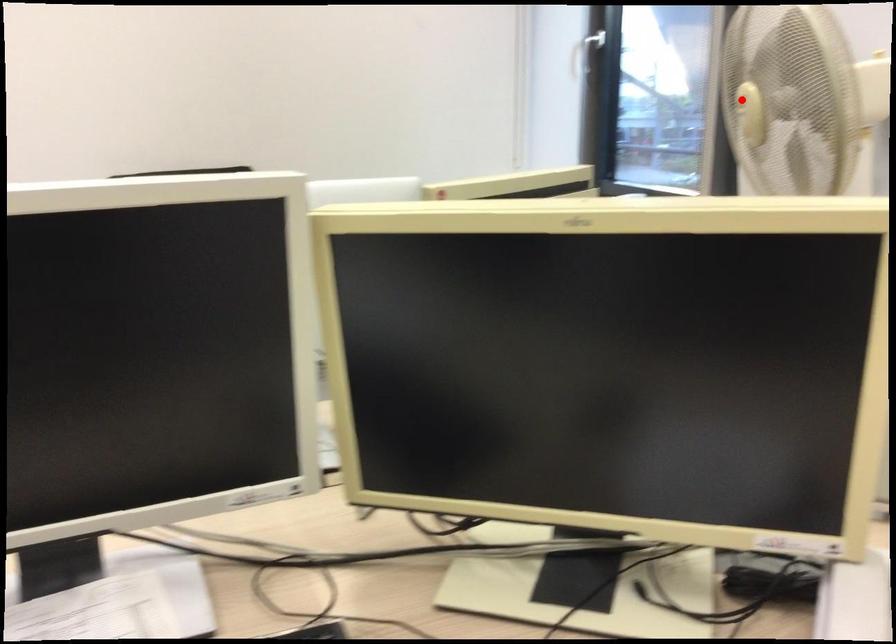
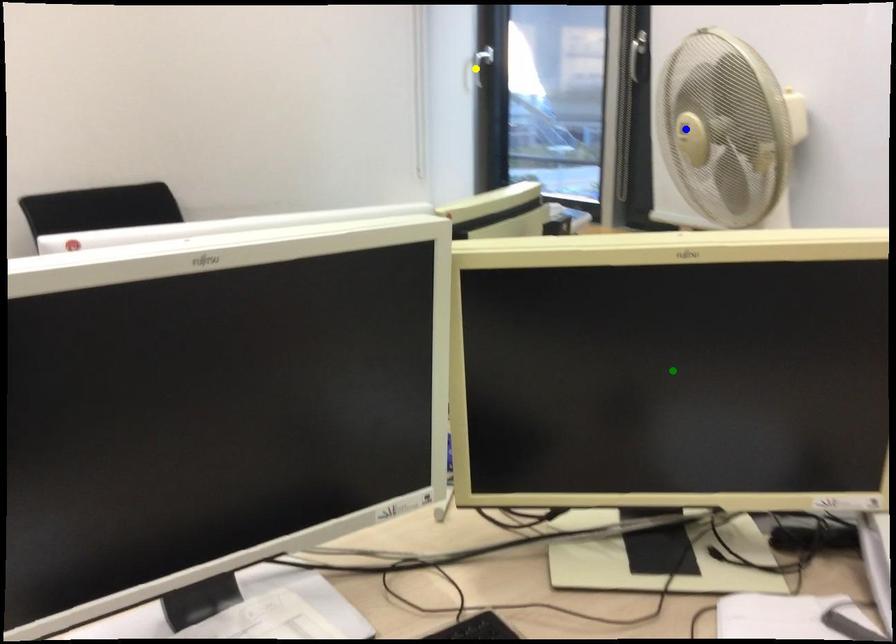
Question: I am providing you with two images of the same scene from different viewpoints. A red point is marked on the first image. You are given multiple points on the second image. Can you choose the point in image 2 that corresponds to the point in image 1?

Choices:
 (A) yellow point
 (B) green point
 (C) blue point

Answer: (C)